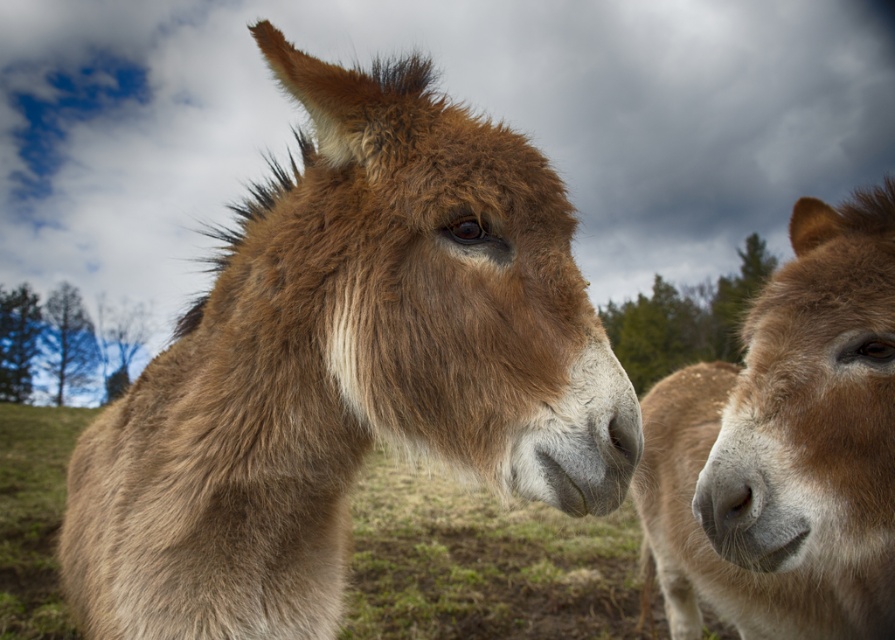
You are a photographer trying to capture a closeup shot of the brown fuzzy nose at center. You notice the brown fuzzy donkey at right is moving closer. Will the donkey block the nose from your view?

The brown fuzzy donkey at right might be wider than brown fuzzy nose at center, so there is a possibility that the donkey could block the nose from view if it moves closer.

You are a photographer who wants to capture both the brown fuzzy donkey at center and the brown fuzzy nose at center in a single shot. Can you tell me which one is closer to the camera?

The brown fuzzy donkey at center is positioned under brown fuzzy nose at center, so the brown fuzzy nose at center is closer to the camera.